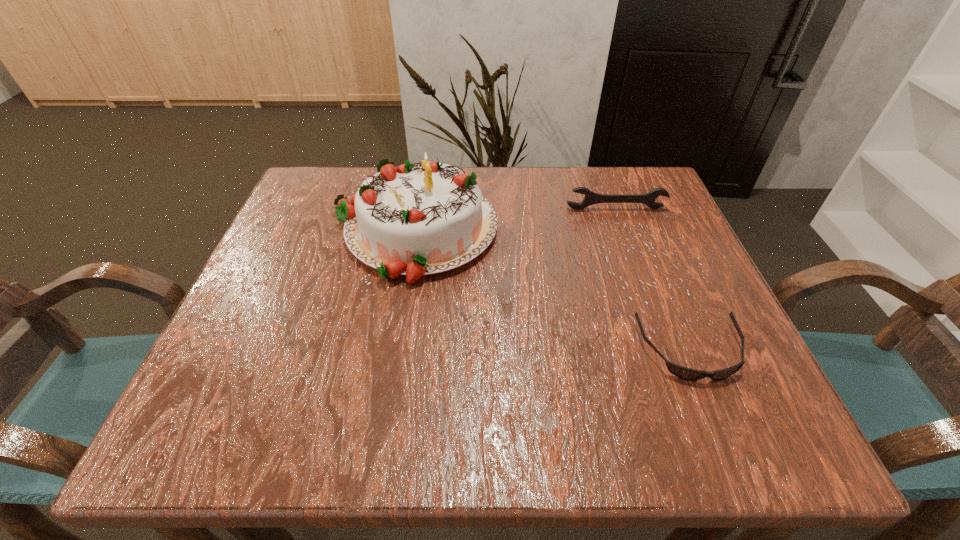
The image size is (960, 540). In order to click on unoccupied area between the leftmost object and the nearest object in this screenshot , I will do `click(552, 291)`.

Locate an element on the screen. The height and width of the screenshot is (540, 960). free space between the wrench and the tallest object is located at coordinates (515, 219).

You are a GUI agent. You are given a task and a screenshot of the screen. Output one action in this format:
    pyautogui.click(x=<x>, y=<y>)
    Task: Click on the vacant area that lies between the second shortest object and the shortest object
    
    Given the screenshot: What is the action you would take?
    pyautogui.click(x=653, y=280)

Where is `free area in between the wrench and the nearest object`? This screenshot has height=540, width=960. free area in between the wrench and the nearest object is located at coordinates (653, 280).

In order to click on vacant space in between the sunglasses and the cake in this screenshot , I will do `click(552, 291)`.

Locate an element on the screen. The image size is (960, 540). vacant area that lies between the leftmost object and the second tallest object is located at coordinates (515, 219).

Image resolution: width=960 pixels, height=540 pixels. Identify the location of free space between the sunglasses and the tallest object. (552, 291).

Locate an element on the screen. The height and width of the screenshot is (540, 960). empty space between the shortest object and the cake is located at coordinates (552, 291).

I want to click on object that ranks as the second closest to the sunglasses, so click(591, 198).

Image resolution: width=960 pixels, height=540 pixels. What are the coordinates of `the closest object relative to the leftmost object` in the screenshot? It's located at (591, 198).